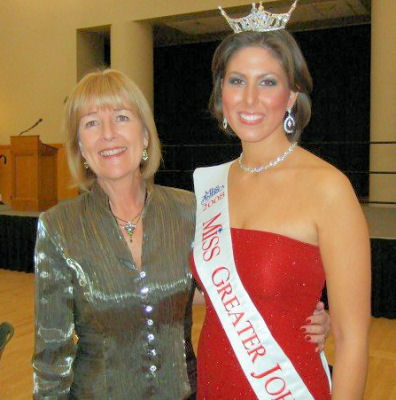
Identify the location of podium. The image size is (396, 400). (28, 171).